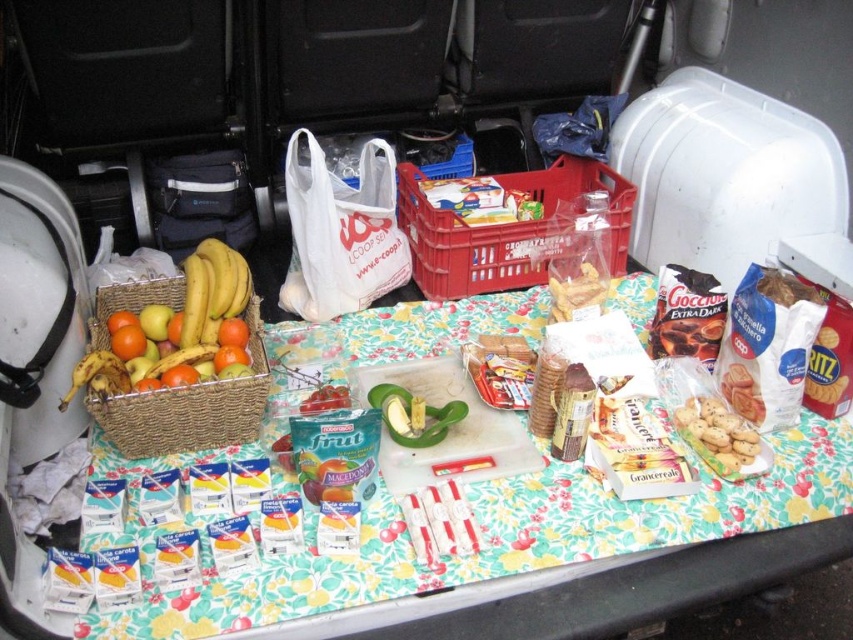
You are trying to place a small item in the trunk of the vehicle. You want to put it as close as possible to both point A at coordinate point (x=236, y=444) and point B at coordinate point (x=585, y=276). Where should you place it?

You should place the item at point A at coordinate point (x=236, y=444) because it is closer to the camera than point B at coordinate point (x=585, y=276).

You are standing at the edge of the trunk and want to place a 1.0 meter long item diagonally from the point at coordinates point (x=770, y=499) to the back of the trunk. Is there enough space? Please consider the distance from the point to the viewer and the trunk dimensions.

The distance from point (x=770, y=499) to the viewer is 1.10 meters. Since the item is 1.0 meters long, it should fit diagonally as the available space is slightly larger than the item.